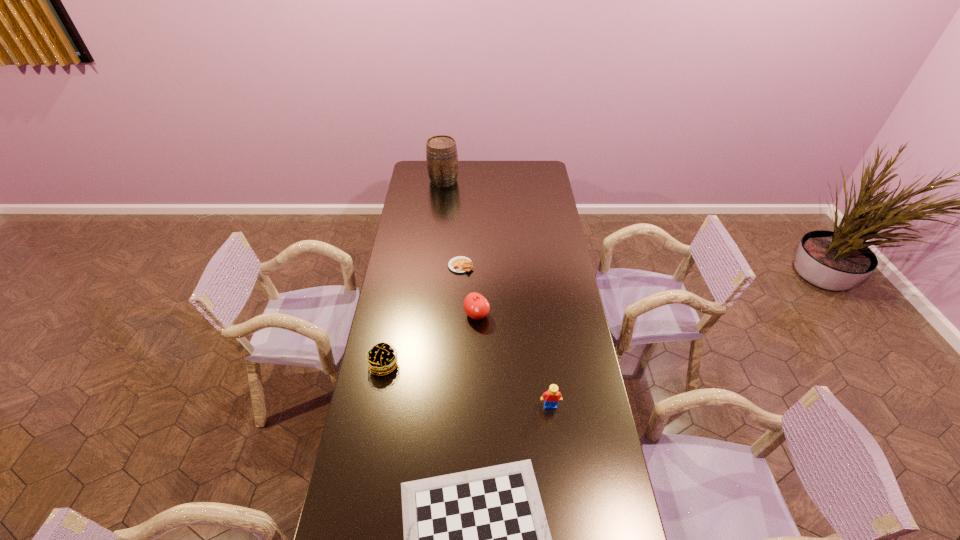
Image resolution: width=960 pixels, height=540 pixels. I want to click on vacant space that satisfies the following two spatial constraints: 1. on the side of the apple near the bung hole; 2. on the left side of the tallest object, so click(x=428, y=315).